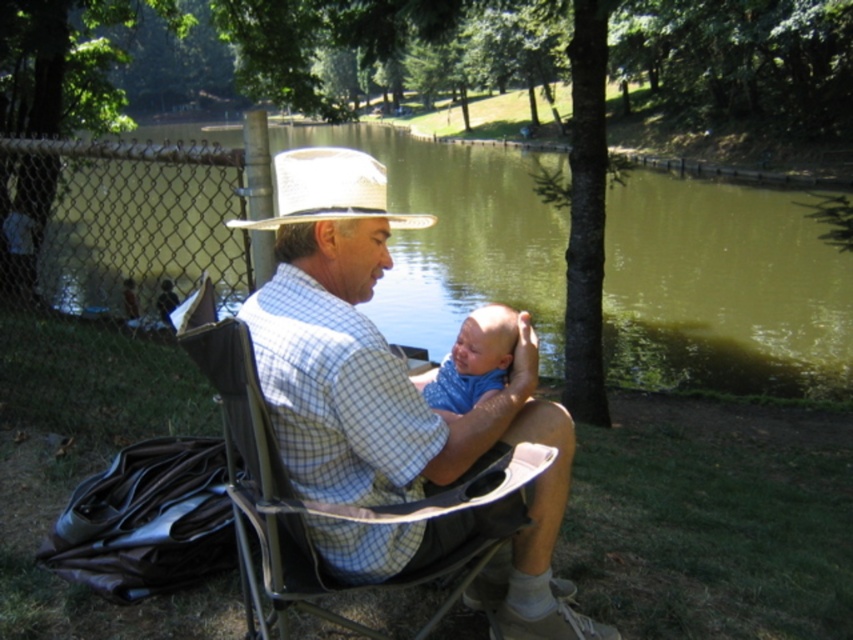
You are a photographer standing in the park and want to take a picture of the green water at center and the white straw hat at upper center. Which object should you focus on first if you want both to be in sharp focus?

The white straw hat at upper center is behind green water at center, so you should focus on the white straw hat at upper center first to ensure both are in sharp focus.

You are a photographer standing at the edge of the water. You want to take a picture of the green water at center and the blue cotton bib at center. Which object will appear taller in the photo?

The green water at center will appear taller in the photo because it has a greater height compared to the blue cotton bib at center.